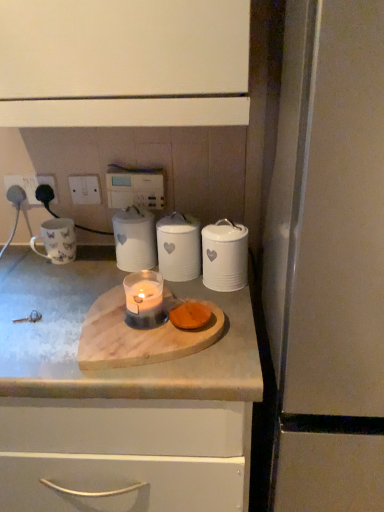
Question: From the image's perspective, would you say white plastic electric outlet at upper left, the 3th electric outlet in the left-to-right sequence, is positioned over white glossy electric outlet at upper left, which is the second electric outlet from right to left?

Choices:
 (A) no
 (B) yes

Answer: (B)

Question: Are white plastic electric outlet at upper left, which ranks as the 1th electric outlet in right-to-left order, and white glossy electric outlet at upper left, which is the second electric outlet from right to left, located far from each other?

Choices:
 (A) yes
 (B) no

Answer: (B)

Question: Can you confirm if white plastic electric outlet at upper left, the 3th electric outlet in the left-to-right sequence, is thinner than white glossy electric outlet at upper left, arranged as the 2th electric outlet when viewed from the left?

Choices:
 (A) yes
 (B) no

Answer: (A)

Question: Is white plastic electric outlet at upper left, the 3th electric outlet in the left-to-right sequence, shorter than white glossy electric outlet at upper left, which is the second electric outlet from right to left?

Choices:
 (A) yes
 (B) no

Answer: (B)

Question: Is white plastic electric outlet at upper left, the 3th electric outlet in the left-to-right sequence, oriented away from white glossy electric outlet at upper left, which is the second electric outlet from right to left?

Choices:
 (A) yes
 (B) no

Answer: (B)

Question: Does white plastic electric outlet at upper left, the 3th electric outlet in the left-to-right sequence, appear on the left side of white glossy electric outlet at upper left, arranged as the 2th electric outlet when viewed from the left?

Choices:
 (A) no
 (B) yes

Answer: (A)

Question: Is white ceramic canister at center, the 1th kitchen appliance viewed from the left, oriented towards translucent glass candle at center?

Choices:
 (A) no
 (B) yes

Answer: (B)

Question: Are white ceramic canister at center, the 1th kitchen appliance viewed from the left, and translucent glass candle at center far apart?

Choices:
 (A) no
 (B) yes

Answer: (A)

Question: Does white ceramic canister at center, the 1th kitchen appliance viewed from the left, have a smaller size compared to translucent glass candle at center?

Choices:
 (A) no
 (B) yes

Answer: (A)

Question: Does white ceramic canister at center, the 1th kitchen appliance viewed from the left, have a greater width compared to translucent glass candle at center?

Choices:
 (A) yes
 (B) no

Answer: (A)

Question: Is white ceramic canister at center, the 3th kitchen appliance from the right, next to translucent glass candle at center?

Choices:
 (A) yes
 (B) no

Answer: (B)

Question: Can you confirm if white ceramic canister at center, the 1th kitchen appliance viewed from the left, is bigger than translucent glass candle at center?

Choices:
 (A) no
 (B) yes

Answer: (B)

Question: Is white glossy electric outlet at upper left, which is the second electric outlet from right to left, smaller than white plastic electric outlet at upper left, the 3th electric outlet in the left-to-right sequence?

Choices:
 (A) yes
 (B) no

Answer: (A)